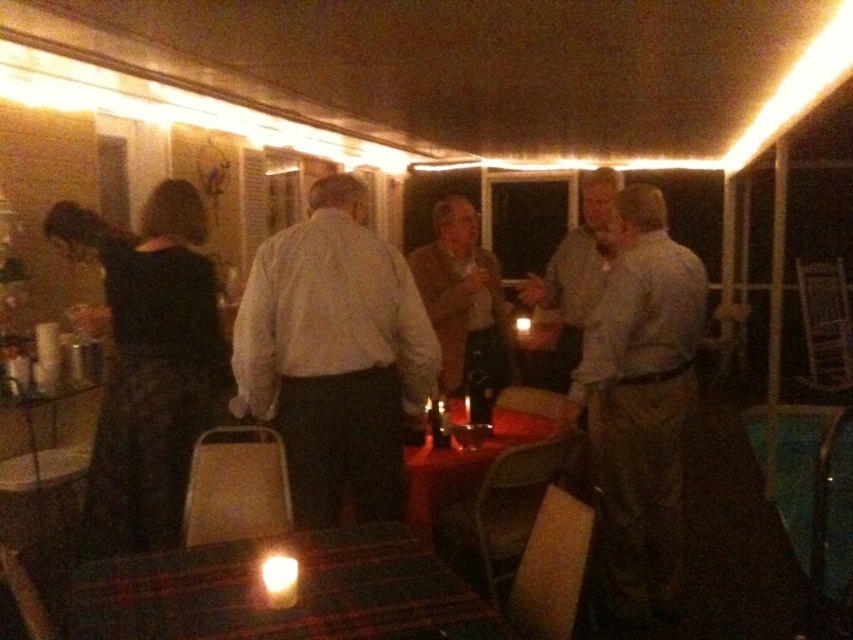
You are a photographer at the event and want to capture a closeup of the white matte shirt at center and the wooden table at center in the same frame. Given that the shirt is closer to you, will the table appear smaller in the photo compared to the shirt?

The white matte shirt at center has a larger size compared to the wooden table at center. Since the shirt is closer to you, it appears larger, making the table look smaller in the photo.

You are at a party and want to find a white matte shirt at center. According to the coordinates given, where should you look in the image?

The white matte shirt at center is located at coordinates point (334, 356).